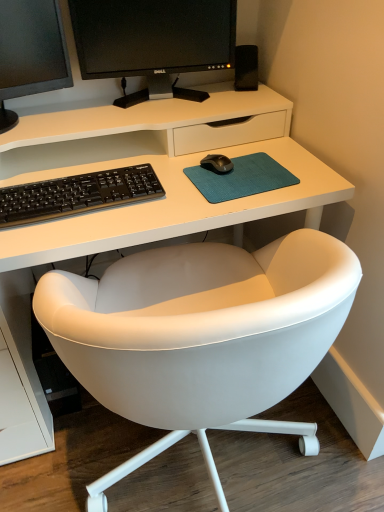
Identify the location of free space in front of black matte speaker at upper right. The image size is (384, 512). pyautogui.click(x=248, y=104).